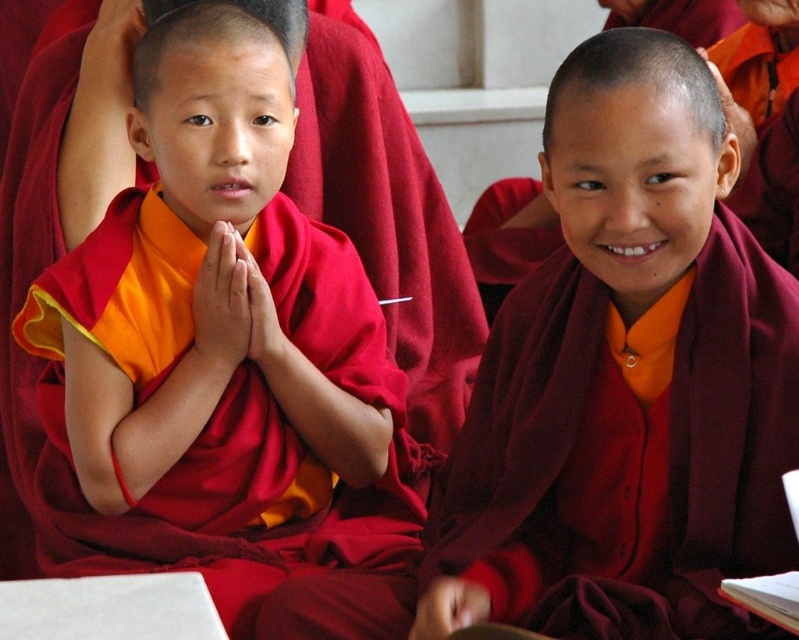
You are a photographer trying to capture both the matte red robe at left and the maroon woolen robe at center in a single frame. Which robe should you focus on first to ensure both are visible without zooming in or out?

The matte red robe at left is larger in size than the maroon woolen robe at center, so you should focus on the matte red robe at left first to ensure it fits within the frame while still capturing the maroon woolen robe at center without needing to adjust the zoom.

You are a photographer planning to take a group photo of the matte red robe at left and the maroon woolen robe at center. Based on their heights, which robe should be placed in the front row to ensure both are visible?

The maroon woolen robe at center should be placed in the front row because the matte red robe at left is taller than the maroon woolen robe at center, so positioning the shorter one in front ensures both are visible.

You are a visitor at a monastery and want to approach the monks. You see the matte red robe at left and the maroon woolen robe at center. Which monk should you approach first if you want to reach the one closer to you?

You should approach the matte red robe at left first because it is closer to you than the maroon woolen robe at center.